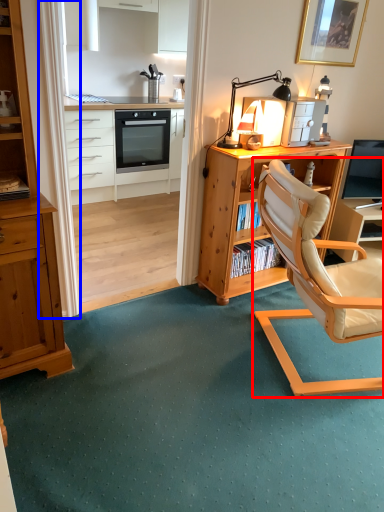
Question: Which of the following is the farthest to the observer, chair (highlighted by a red box) or curtain (highlighted by a blue box)?

Choices:
 (A) chair
 (B) curtain

Answer: (B)